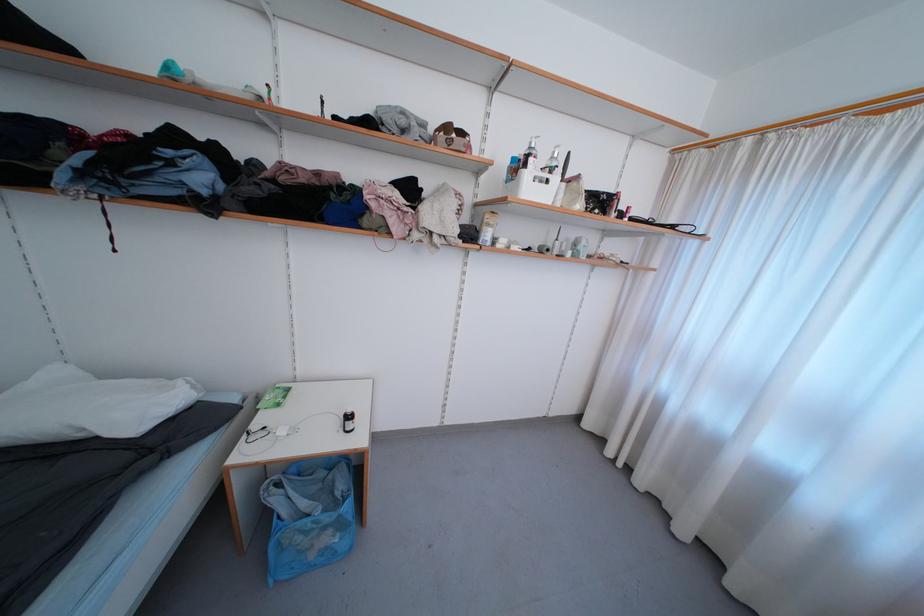
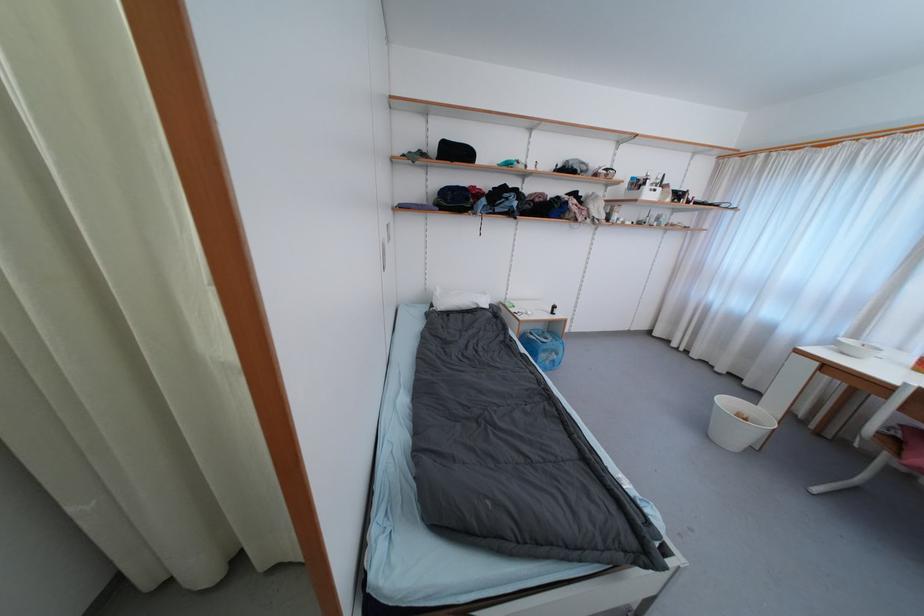
In the second image, find the point that corresponds to point (284, 488) in the first image.

(535, 336)